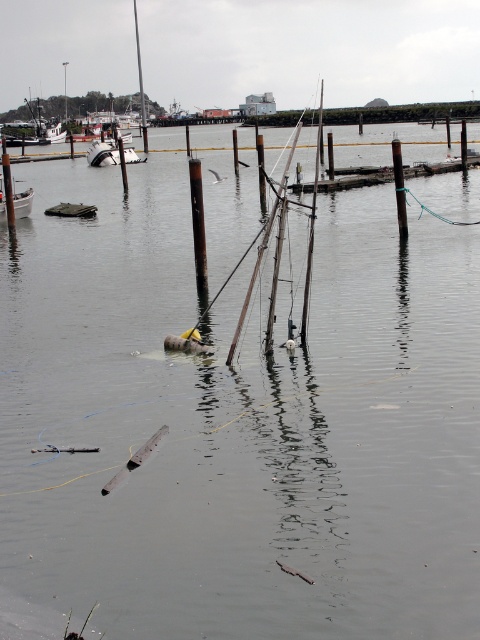
You are standing at the edge of the marina and see the white plastic boat at left and the white matte boat at upper left. Which boat is closer to you?

The white plastic boat at left is closer to the viewer than the white matte boat at upper left.

You are standing at the point with coordinates point [0,179] and want to reach the point with coordinates point [311,205]. Which direction should you move to get there?

You should move forward because point [311,205] is in front of point [0,179].

You are a dock inspector checking the marina. You notice the rusty metal barrel at center and the white matte boat at upper left. Which object requires immediate attention based on its size relative to the other?

The rusty metal barrel at center requires immediate attention because it is bigger than the white matte boat at upper left, which might pose a safety hazard in the marina.